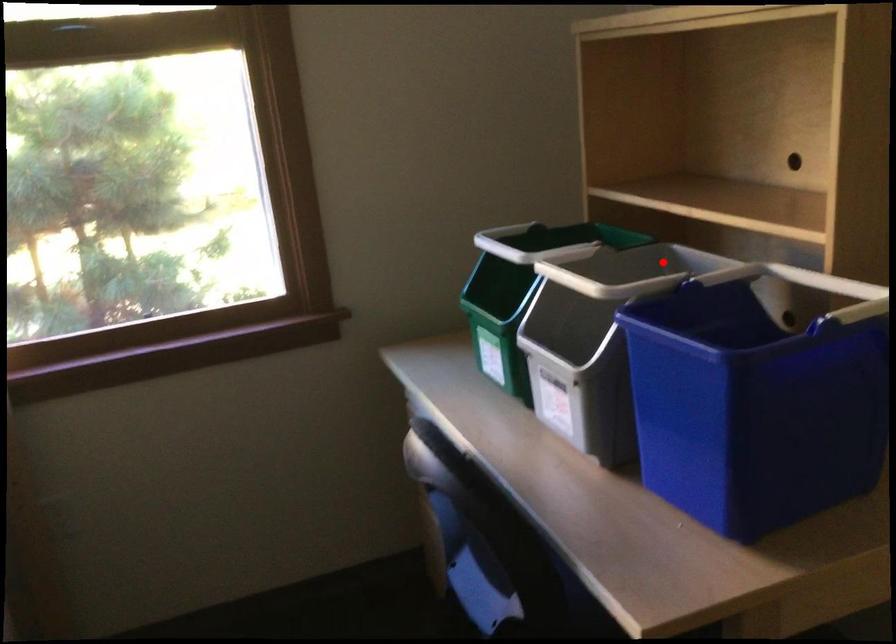
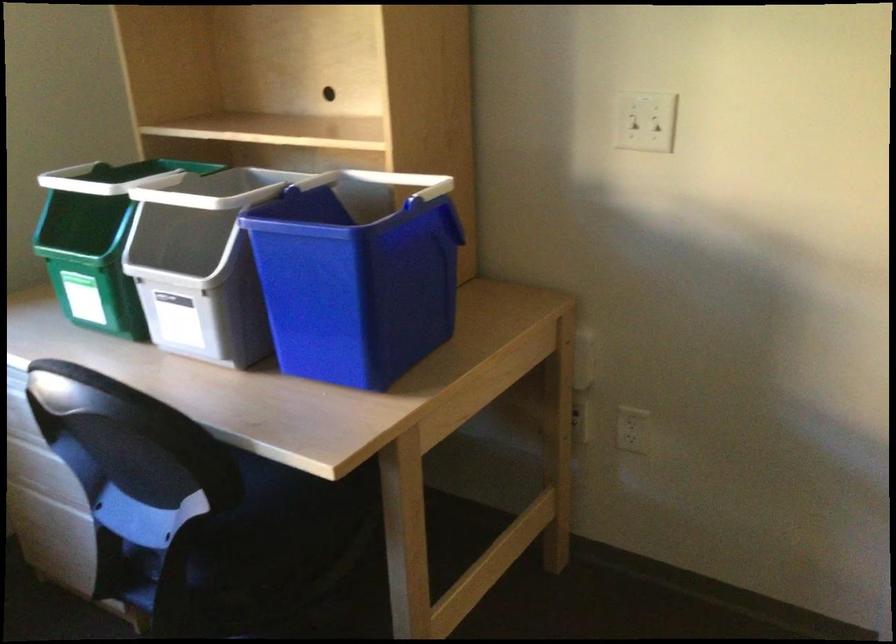
In the second image, find the point that corresponds to the highlighted location in the first image.

(245, 185)